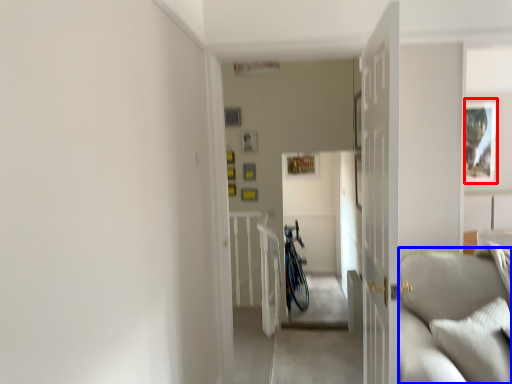
Question: Which point is closer to the camera, picture frame (highlighted by a red box) or couch (highlighted by a blue box)?

Choices:
 (A) picture frame
 (B) couch

Answer: (B)